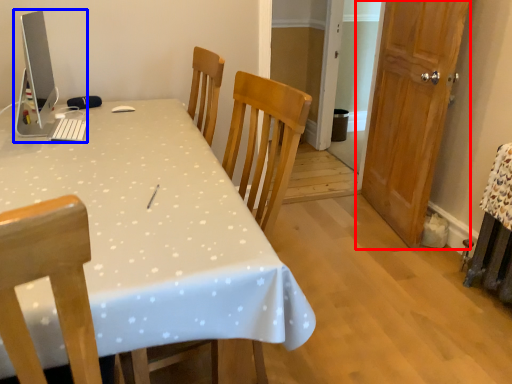
Question: Which object appears closest to the camera in this image, door (highlighted by a red box) or desktop computer (highlighted by a blue box)?

Choices:
 (A) door
 (B) desktop computer

Answer: (B)